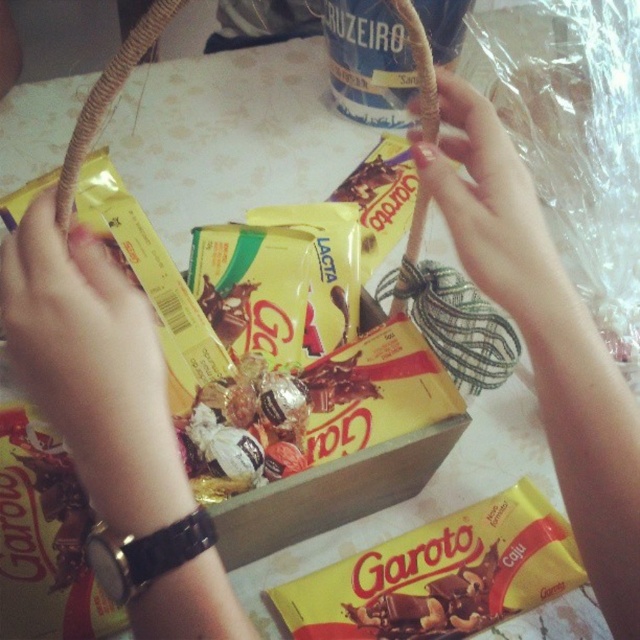
You are trying to grab the yellow matte chocolate bar at center without dropping the basket. Since the smooth skin hand at center is holding the basket handle, can you use the same hand to reach the chocolate bar?

The smooth skin hand at center is taller than the yellow matte chocolate bar at center, so yes, you can use the same hand to reach the chocolate bar while still holding the basket handle.

Please provide the coordinates of the yellow matte chocolate bar at center in the image. The coordinate system is based on the image dimensions with the origin at the bottom left corner. The x and y values are normalized between 0 and 1. The answer should be in the format of a tuple with two decimal places, like this example format for a point at 0.5,0.5 would be written as 0.50,0.50. The question must not mention coordinates or any details from the Objects Description. The question must be phrased as if it

The coordinates of the yellow matte chocolate bar at center are (441,576).

You are a delivery person who needs to place a yellow matte chocolate bar at center and a smooth beige rope at upper center into a box. The box has a height of 12 inches. Can both items fit vertically in the box without overlapping?

The yellow matte chocolate bar at center is 11.38 inches from the smooth beige rope at upper center. Since the box is 12 inches tall, both items can fit vertically in the box without overlapping as their combined height is less than the box height.